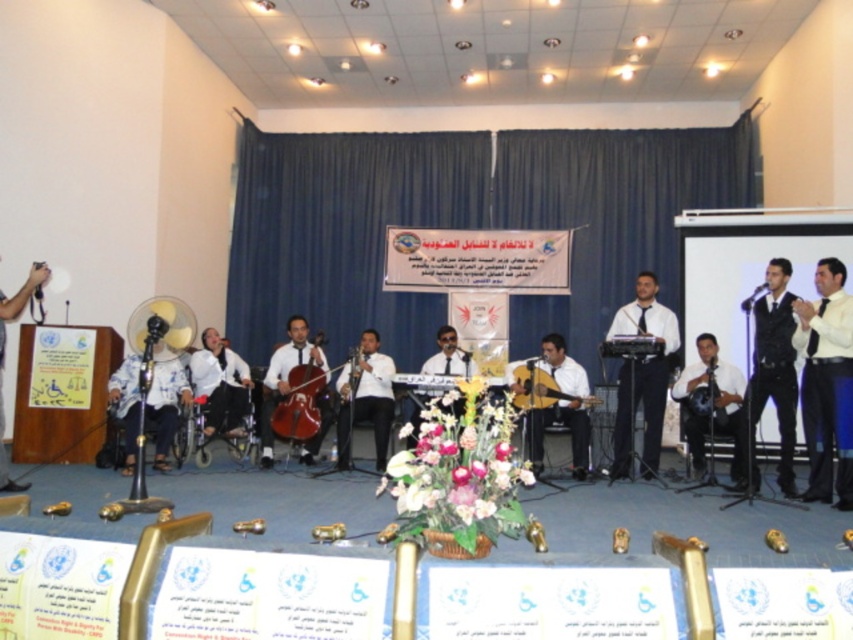
You are standing in the audience watching the performance. The musician wearing the white shirt at center is facing you. If you want to wave to them, will they be able to see your hand movement?

The white shirt at center and viewer are 18.02 feet apart from each other, so yes, the musician can see your hand movement from that distance.

You are a photographer at the event and need to place your matte black camera at left and white glossy guitar at center in your shot. Which object will appear larger in your photo?

The matte black camera at left will appear larger in the photo since it is bigger than the white glossy guitar at center.

You are a stagehand setting up for a performance. You need to ensure that the matte black guitar at center and the matte black violin at center are placed so that the taller instrument is positioned where it won

The matte black guitar at center is taller than the matte black violin at center, so you should position the matte black guitar at center in the spot where the taller instrument needs to be placed.